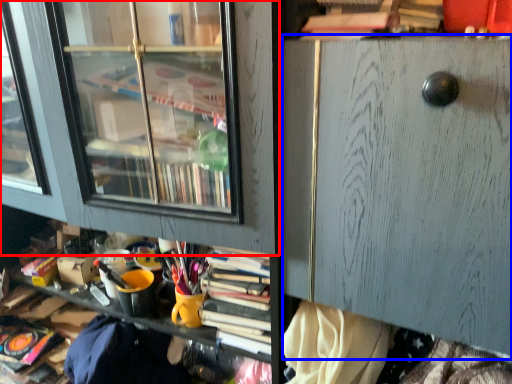
Question: Which object is closer to the camera taking this photo, shelf (highlighted by a red box) or file cabinet (highlighted by a blue box)?

Choices:
 (A) shelf
 (B) file cabinet

Answer: (B)